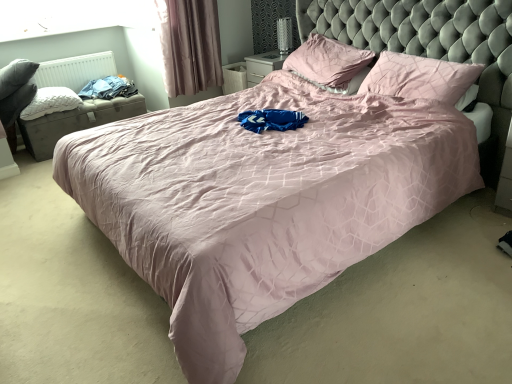
Question: From the image's perspective, is pink satin pillow at upper center, which is the 2th pillow in left-to-right order, beneath metallic silver table lamp at upper center?

Choices:
 (A) yes
 (B) no

Answer: (A)

Question: Are pink satin pillow at upper center, which is the 2th pillow in left-to-right order, and metallic silver table lamp at upper center beside each other?

Choices:
 (A) yes
 (B) no

Answer: (B)

Question: Is pink satin pillow at upper center, which is the second pillow from right to left, further to camera compared to metallic silver table lamp at upper center?

Choices:
 (A) no
 (B) yes

Answer: (A)

Question: Could you tell me if pink satin pillow at upper center, which is the 2th pillow in left-to-right order, is turned towards metallic silver table lamp at upper center?

Choices:
 (A) no
 (B) yes

Answer: (A)

Question: Is pink satin pillow at upper center, which is the second pillow from right to left, bigger than metallic silver table lamp at upper center?

Choices:
 (A) no
 (B) yes

Answer: (B)

Question: Is blue cotton clothes at left in front of or behind pink satin pillow at upper center, which is the 2th pillow in left-to-right order, in the image?

Choices:
 (A) front
 (B) behind

Answer: (B)

Question: From a real-world perspective, is blue cotton clothes at left physically located above or below pink satin pillow at upper center, which is the 2th pillow in left-to-right order?

Choices:
 (A) below
 (B) above

Answer: (A)

Question: Is blue cotton clothes at left wider or thinner than pink satin pillow at upper center, which is the 2th pillow in left-to-right order?

Choices:
 (A) thin
 (B) wide

Answer: (B)

Question: From the image's perspective, is blue cotton clothes at left located above or below pink satin pillow at upper center, which is the 2th pillow in left-to-right order?

Choices:
 (A) above
 (B) below

Answer: (B)

Question: Is white matte radiator at upper left situated inside pink satin pillow at upper center, which is the second pillow from right to left, or outside?

Choices:
 (A) outside
 (B) inside

Answer: (A)

Question: Relative to pink satin pillow at upper center, which is the 2th pillow in left-to-right order, is white matte radiator at upper left in front or behind?

Choices:
 (A) front
 (B) behind

Answer: (B)

Question: Is white matte radiator at upper left taller or shorter than pink satin pillow at upper center, which is the 2th pillow in left-to-right order?

Choices:
 (A) short
 (B) tall

Answer: (A)

Question: Considering the positions of white matte radiator at upper left and pink satin pillow at upper center, which is the second pillow from right to left, in the image, is white matte radiator at upper left bigger or smaller than pink satin pillow at upper center, which is the second pillow from right to left,?

Choices:
 (A) small
 (B) big

Answer: (A)

Question: From the image's perspective, is mauve velvet curtain at upper left above or below white quilted pillow at left, marked as the 3th pillow in a right-to-left arrangement?

Choices:
 (A) below
 (B) above

Answer: (B)

Question: From a real-world perspective, relative to white quilted pillow at left, arranged as the 1th pillow when viewed from the left, is mauve velvet curtain at upper left vertically above or below?

Choices:
 (A) below
 (B) above

Answer: (B)